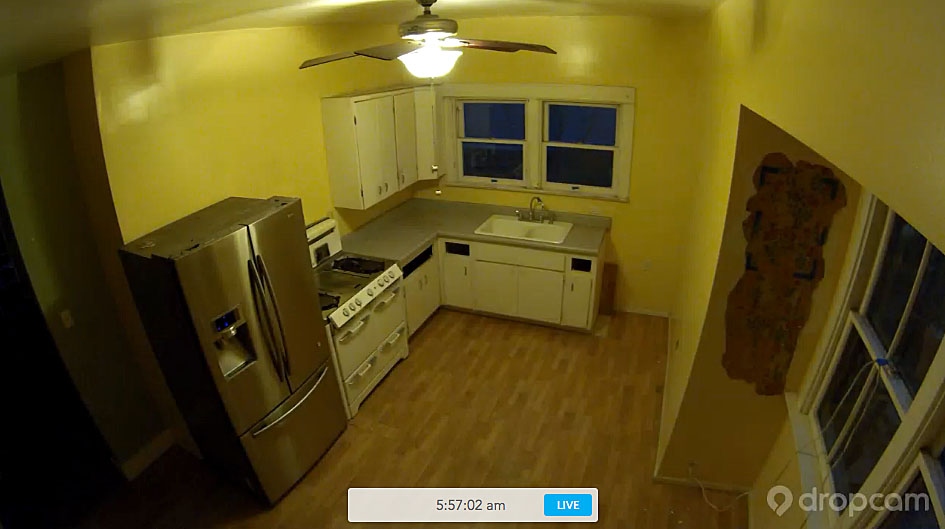
This screenshot has width=945, height=529. Identify the location of cord connected to outlet. (689, 469).